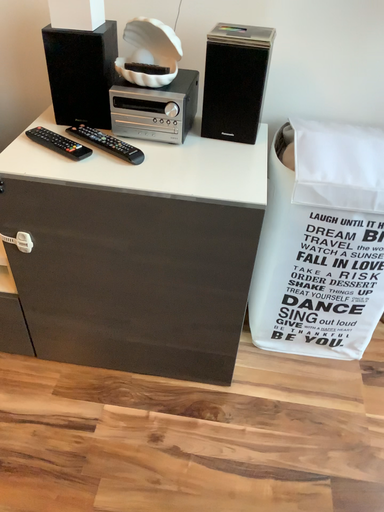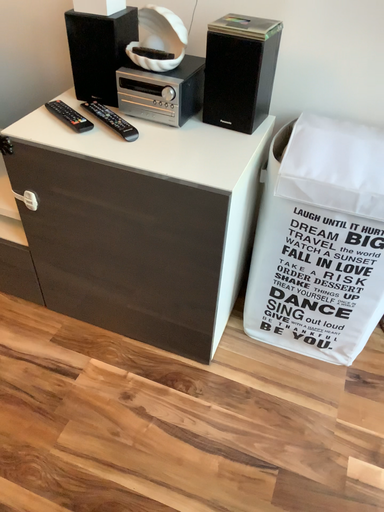
Question: Which way did the camera rotate in the video?

Choices:
 (A) rotated right
 (B) rotated left

Answer: (B)